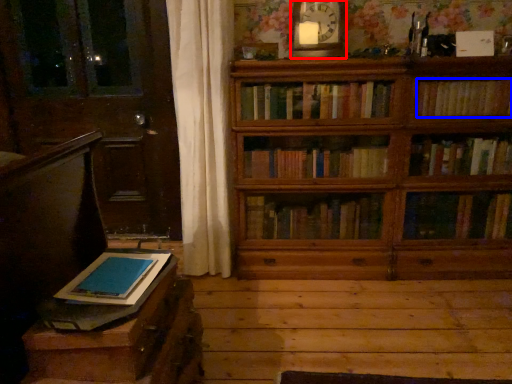
Question: Which object is closer to the camera taking this photo, clock (highlighted by a red box) or book (highlighted by a blue box)?

Choices:
 (A) clock
 (B) book

Answer: (A)